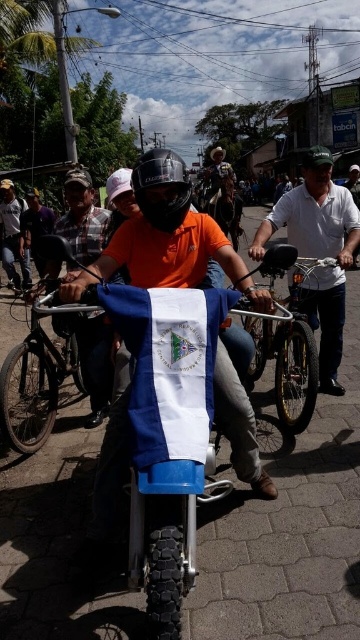
You are a photographer standing at the edge of the street. You want to take a photo that includes both the metallic silver bicycle at center and the matte orange shirt at center. Which object should you focus on first to ensure both are in frame?

Since the metallic silver bicycle at center is larger in size than the matte orange shirt at center, you should focus on the metallic silver bicycle at center first to ensure it fits within the frame before adjusting for the smaller matte orange shirt at center.

You are a photographer standing at the edge of a busy street. You want to capture both the white cotton shirt at center and the matte orange shirt at center in a single photo. Can you fit both subjects into your camera frame if your camera has a maximum horizontal field of view of 20 feet?

The white cotton shirt at center and the matte orange shirt at center are 19.36 feet apart. Since the distance between them is less than the camera frame of 20 feet, both can be captured in a single photo.

You are a delivery person who needs to reach a package located at the orange shirt at center. There is a metallic silver bicycle at center blocking your path. Can you walk around it without crossing the street? Explain your reasoning based on the distance between them.

The metallic silver bicycle at center is 6.55 meters away from the orange shirt at center. Since the distance is relatively large, you can easily walk around the bicycle without needing to cross the street. The 6.55 meters provide enough space to maneuver around the obstacle safely.